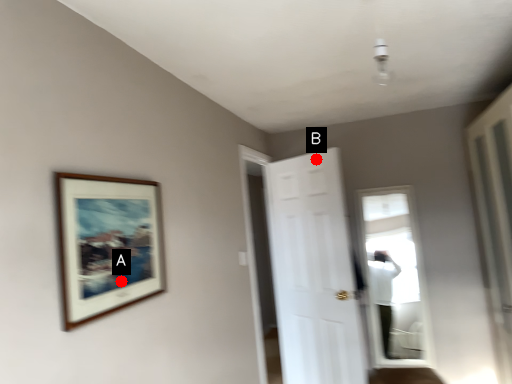
Question: Two points are circled on the image, labeled by A and B beside each circle. Which of the following is the closest to the observer?

Choices:
 (A) A is closer
 (B) B is closer

Answer: (A)